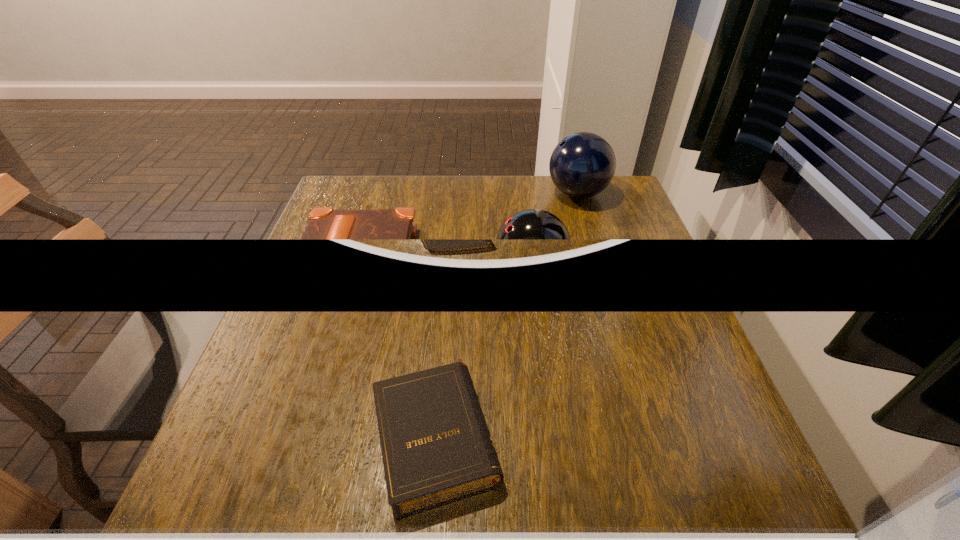
You are a GUI agent. You are given a task and a screenshot of the screen. Output one action in this format:
    pyautogui.click(x=<x>, y=<y>)
    Task: Click on the farthest object
    Image resolution: width=960 pixels, height=540 pixels.
    Given the screenshot: What is the action you would take?
    pyautogui.click(x=582, y=165)

At what (x,y) coordinates should I click in order to perform the action: click on the nearer bowling ball. Please return your answer as a coordinate pair (x, y). This screenshot has width=960, height=540. Looking at the image, I should click on (531, 223).

Image resolution: width=960 pixels, height=540 pixels. In order to click on the leftmost object in this screenshot , I will do `click(324, 222)`.

You are a GUI agent. You are given a task and a screenshot of the screen. Output one action in this format:
    pyautogui.click(x=<x>, y=<y>)
    Task: Click on the shortest object
    The width and height of the screenshot is (960, 540).
    Given the screenshot: What is the action you would take?
    pyautogui.click(x=324, y=222)

This screenshot has height=540, width=960. I want to click on free space located on the surface of the farthest object near the finger holes, so click(x=414, y=194).

Where is `free space located on the surface of the farthest object near the finger holes`? free space located on the surface of the farthest object near the finger holes is located at coordinates (420, 194).

Find the location of a particular element. The width and height of the screenshot is (960, 540). blank space located on the surface of the farthest object near the finger holes is located at coordinates 515,194.

At what (x,y) coordinates should I click in order to perform the action: click on free spot located 0.230m on the surface of the nearer bowling ball near the finger holes. Please return your answer as a coordinate pair (x, y). The height and width of the screenshot is (540, 960). Looking at the image, I should click on (395, 274).

At what (x,y) coordinates should I click in order to perform the action: click on vacant region located on the surface of the nearer bowling ball near the finger holes. Please return your answer as a coordinate pair (x, y). Image resolution: width=960 pixels, height=540 pixels. Looking at the image, I should click on (360, 274).

The image size is (960, 540). In order to click on blank space located on the surface of the nearer bowling ball near the finger holes in this screenshot , I will do `click(443, 274)`.